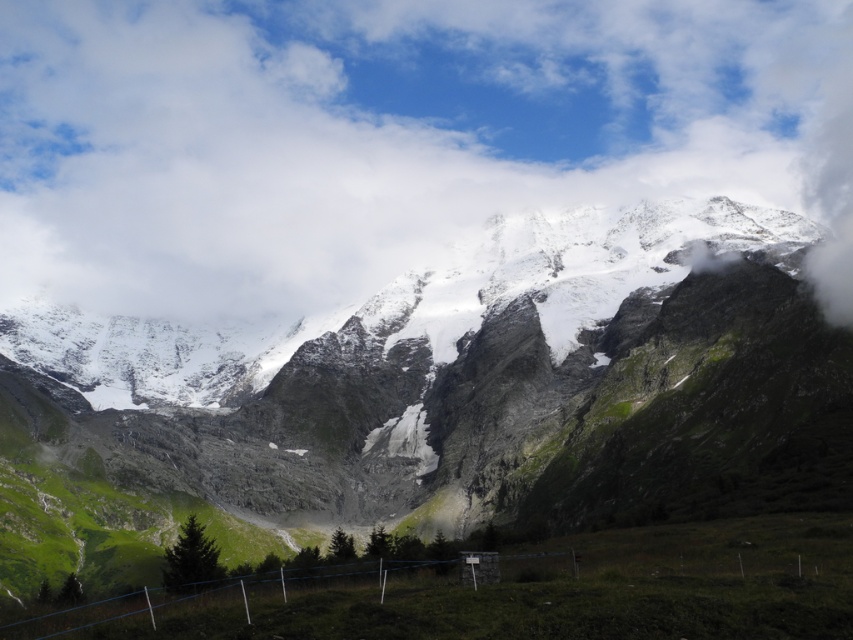
Question: Is white fluffy cloud at upper center smaller than snowy granite mountain range at upper center?

Choices:
 (A) yes
 (B) no

Answer: (B)

Question: Does white fluffy cloud at upper center appear under snowy granite mountain range at upper center?

Choices:
 (A) yes
 (B) no

Answer: (B)

Question: Which object appears closest to the camera in this image?

Choices:
 (A) snowy granite mountain range at upper center
 (B) white fluffy cloud at upper center

Answer: (A)

Question: From the image, what is the correct spatial relationship of white fluffy cloud at upper center in relation to snowy granite mountain range at upper center?

Choices:
 (A) left
 (B) right

Answer: (B)

Question: Which point appears farthest from the camera in this image?

Choices:
 (A) (767, 433)
 (B) (138, 60)

Answer: (B)

Question: Among these points, which one is farthest from the camera?

Choices:
 (A) (321, 68)
 (B) (577, 292)

Answer: (A)